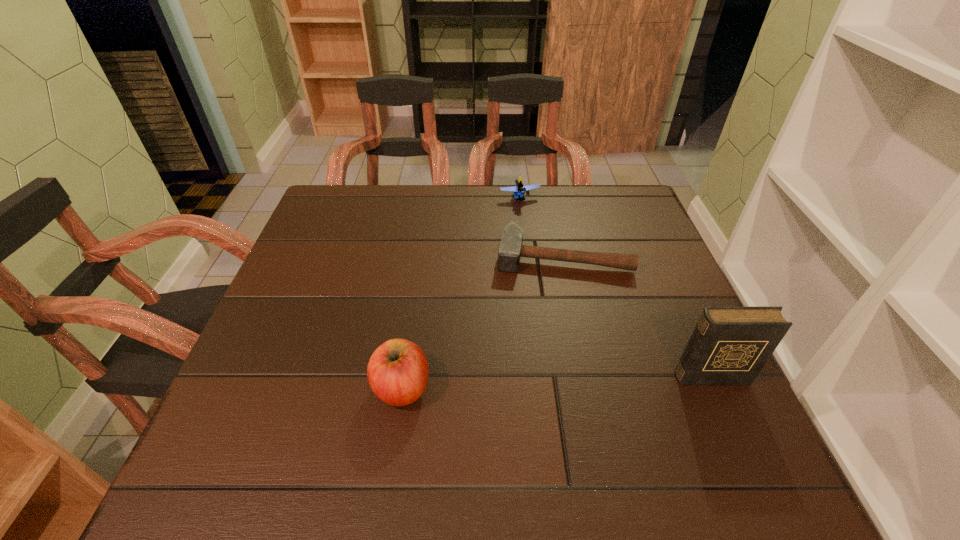
Where is `blank space located on the front-facing side of the farthest object`? blank space located on the front-facing side of the farthest object is located at coordinates (529, 219).

Where is `free space located 0.110m on the front-facing side of the farthest object`? The image size is (960, 540). free space located 0.110m on the front-facing side of the farthest object is located at coordinates [x=533, y=229].

Image resolution: width=960 pixels, height=540 pixels. Identify the location of free space located 0.330m on the front-facing side of the farthest object. (555, 284).

Identify the location of vacant region located on the striking surface of the second farthest object. (555, 294).

Find the location of a particular element. vacant space located 0.080m on the striking surface of the second farthest object is located at coordinates (555, 300).

Find the location of a particular element. The image size is (960, 540). free space located 0.060m on the striking surface of the second farthest object is located at coordinates (555, 294).

At what (x,y) coordinates should I click in order to perform the action: click on object present at the far edge. Please return your answer as a coordinate pair (x, y). Looking at the image, I should click on (519, 190).

Where is `object that is at the near edge`? Image resolution: width=960 pixels, height=540 pixels. object that is at the near edge is located at coordinates (397, 372).

Where is `diary present at the right edge`? The height and width of the screenshot is (540, 960). diary present at the right edge is located at coordinates (730, 345).

Locate an element on the screen. The width and height of the screenshot is (960, 540). hammer that is at the right edge is located at coordinates (510, 250).